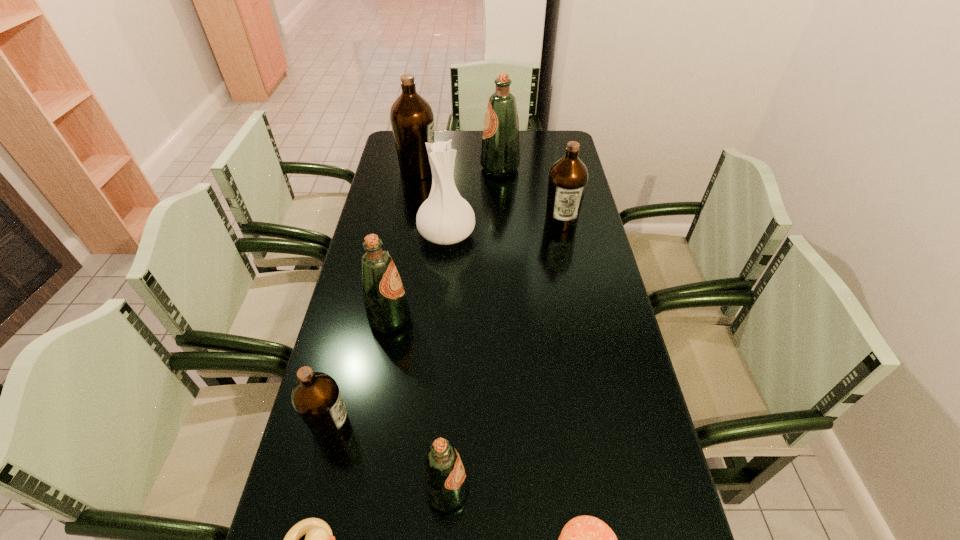
Locate an element on the screen. the biggest green olive oil is located at coordinates (500, 153).

The height and width of the screenshot is (540, 960). Find the location of `the rightmost green olive oil`. the rightmost green olive oil is located at coordinates (500, 153).

Locate an element on the screen. This screenshot has height=540, width=960. the farthest brown olive oil is located at coordinates (411, 116).

Locate an element on the screen. Image resolution: width=960 pixels, height=540 pixels. vase is located at coordinates (445, 218).

The width and height of the screenshot is (960, 540). I want to click on the third nearest olive oil, so (x=386, y=306).

Find the location of a particular element. The height and width of the screenshot is (540, 960). the leftmost green olive oil is located at coordinates tap(386, 306).

Identify the location of the second biggest brown olive oil. (568, 177).

Where is `the second farthest brown olive oil`? The width and height of the screenshot is (960, 540). the second farthest brown olive oil is located at coordinates (568, 177).

Where is `the fourth olive oil from left to right`? This screenshot has height=540, width=960. the fourth olive oil from left to right is located at coordinates (445, 483).

In order to click on the second green olive oil from right to left in this screenshot , I will do `click(445, 483)`.